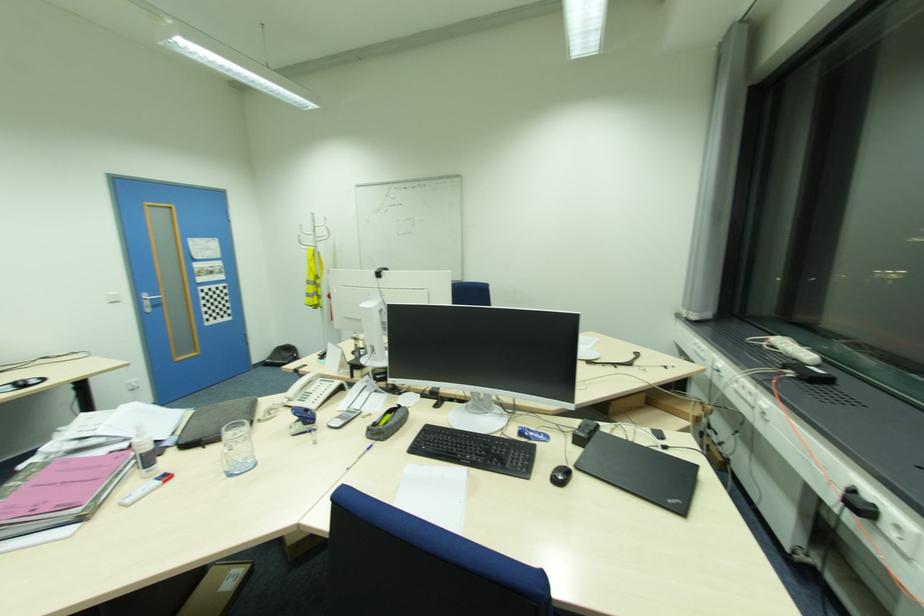
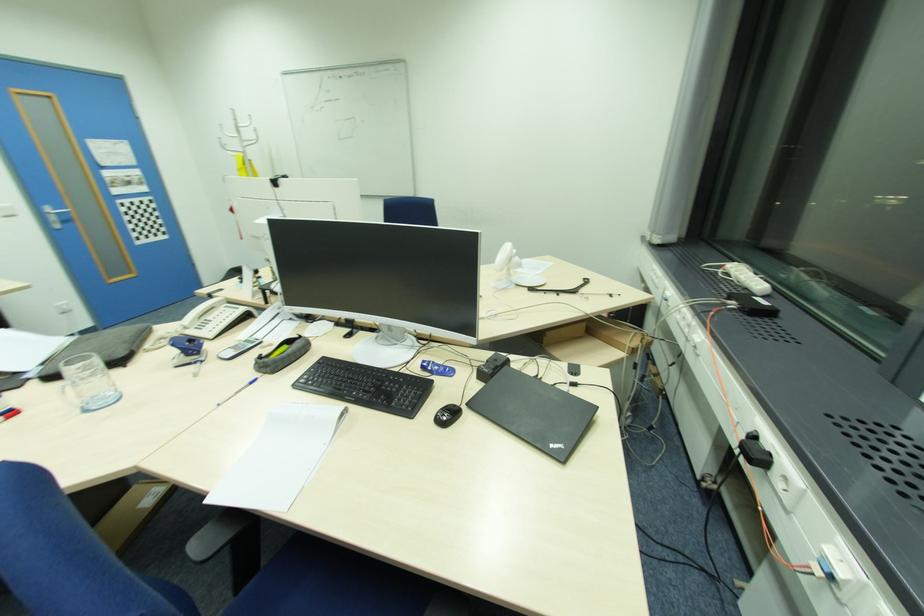
In the second image, find the point that corresponds to (298,371) in the first image.

(213, 294)